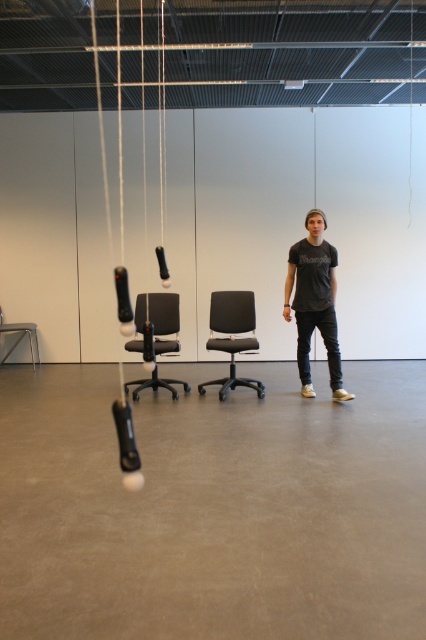
Question: Is dark gray t-shirt at center thinner than metallic gray chair at lower left?

Choices:
 (A) yes
 (B) no

Answer: (B)

Question: Based on their relative distances, which object is nearer to the matte black office chair at center?

Choices:
 (A) metallic gray chair at lower left
 (B) dark gray t-shirt at center
 (C) black matte chair at center

Answer: (C)

Question: Is dark gray t-shirt at center positioned before black matte chair at center?

Choices:
 (A) yes
 (B) no

Answer: (A)

Question: Among these points, which one is nearest to the camera?

Choices:
 (A) (32, 349)
 (B) (170, 388)
 (C) (218, 344)

Answer: (B)

Question: Which object is positioned closest to the black matte chair at center?

Choices:
 (A) matte black office chair at center
 (B) metallic gray chair at lower left
 (C) dark gray t-shirt at center

Answer: (A)

Question: Does dark gray t-shirt at center have a greater width compared to matte black office chair at center?

Choices:
 (A) no
 (B) yes

Answer: (A)